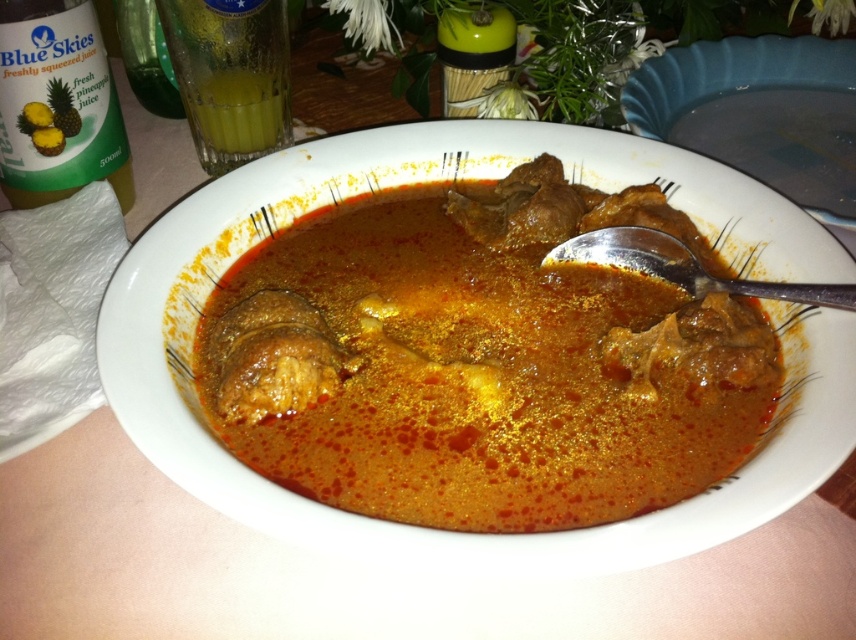
Question: Which point is farther from the camera taking this photo?

Choices:
 (A) (556, 256)
 (B) (232, 152)
 (C) (223, 97)

Answer: (B)

Question: Does brown matte stew at center have a greater width compared to silver metallic spoon at upper right?

Choices:
 (A) yes
 (B) no

Answer: (A)

Question: Which of the following is the closest to the observer?

Choices:
 (A) green glass bottle at upper left
 (B) translucent glass at upper left
 (C) green translucent glass at upper left
 (D) silver metallic spoon at upper right

Answer: (D)

Question: Can you confirm if brown matte stew at center is wider than green glass bottle at upper left?

Choices:
 (A) yes
 (B) no

Answer: (A)

Question: Is silver metallic spoon at upper right in front of translucent glass at upper left?

Choices:
 (A) yes
 (B) no

Answer: (A)

Question: Which of the following is the farthest from the observer?

Choices:
 (A) translucent glass at upper left
 (B) green glass bottle at upper left
 (C) green translucent glass at upper left
 (D) brown matte stew at center

Answer: (A)